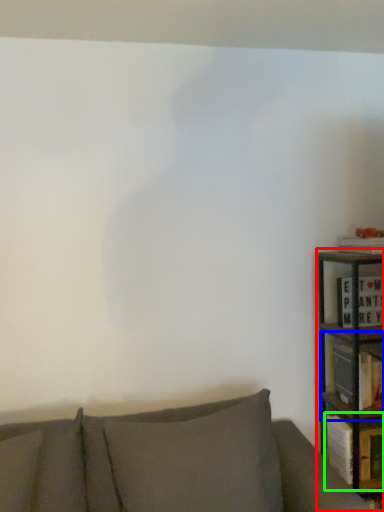
Question: Which object is the closest to the bookcase (highlighted by a red box)? Choose among these: shelf (highlighted by a blue box) or book (highlighted by a green box).

Choices:
 (A) shelf
 (B) book

Answer: (A)